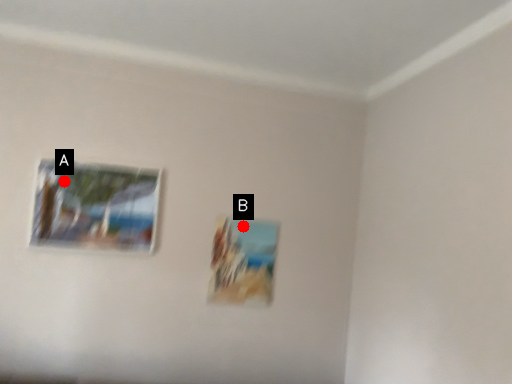
Question: Two points are circled on the image, labeled by A and B beside each circle. Which point is closer to the camera?

Choices:
 (A) A is closer
 (B) B is closer

Answer: (A)